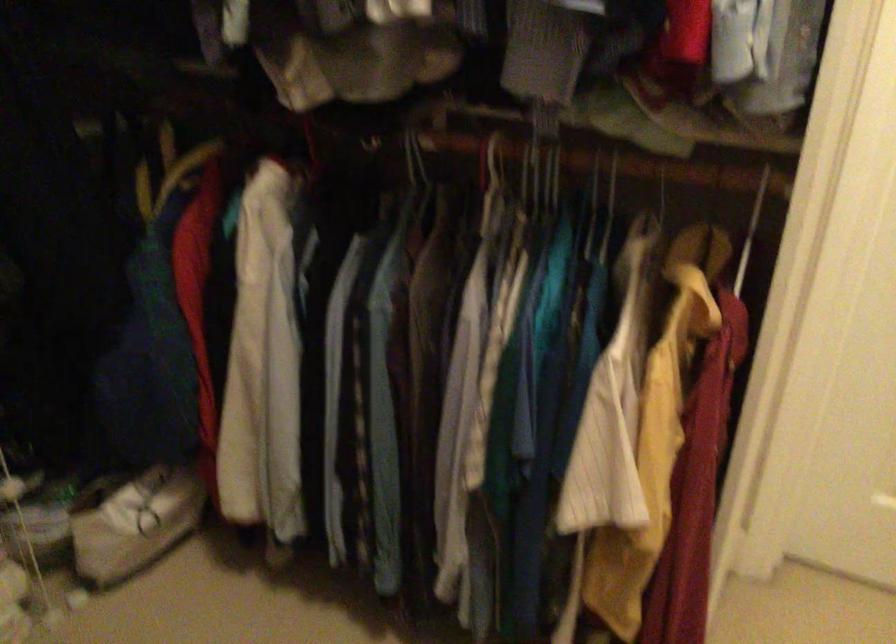
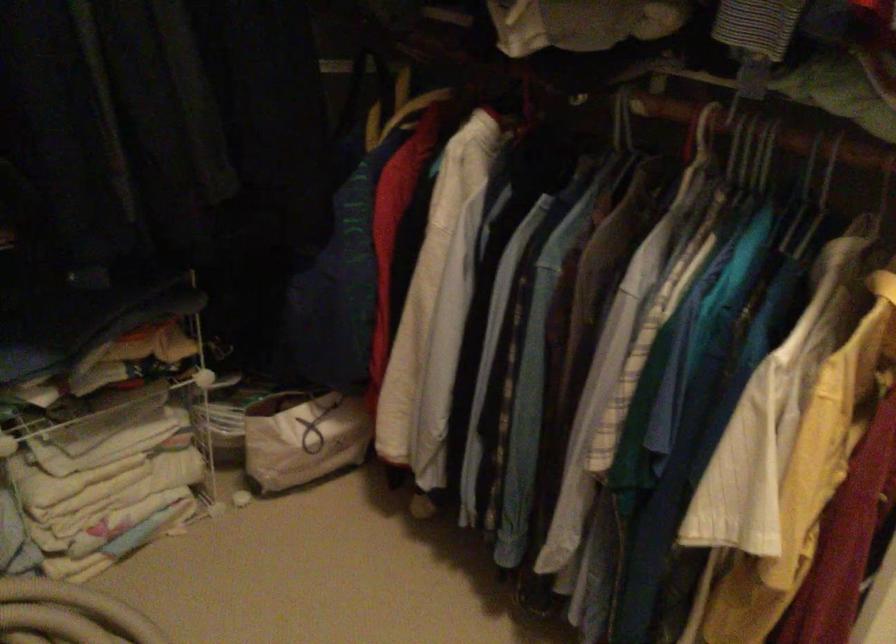
In the second image, find the point that corresponds to the point at 494,158 in the first image.

(702, 134)